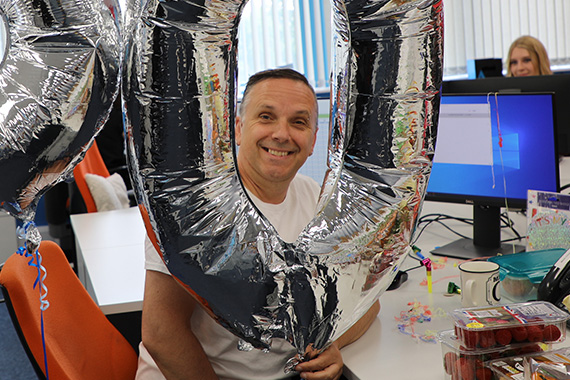
The width and height of the screenshot is (570, 380). What are the coordinates of `empty space on desk` in the screenshot? It's located at (123, 235).